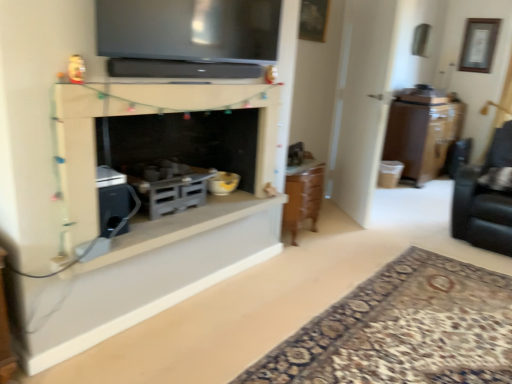
Question: Would you say wooden framed artwork at upper right, arranged as the first picture frame when viewed from the back, is inside or outside wooden picture frame at upper center, the 1th picture frame from the front?

Choices:
 (A) outside
 (B) inside

Answer: (A)

Question: From the image's perspective, relative to wooden picture frame at upper center, the 1th picture frame in the bottom-to-top sequence, is wooden framed artwork at upper right, the second picture frame when ordered from bottom to top, above or below?

Choices:
 (A) below
 (B) above

Answer: (B)

Question: Estimate the real-world distances between objects in this image. Which object is farther from the brown wood cabinet at right?

Choices:
 (A) wooden picture frame at upper center, the 2th picture frame when ordered from top to bottom
 (B) matte gray stove at center, the third appliance when ordered from top to bottom
 (C) white glossy bowl at center, the 2th appliance when ordered from bottom to top
 (D) white matte fireplace at center, the 1th window sill in the top-to-bottom sequence
 (E) wooden framed artwork at upper right, the second picture frame viewed from the left

Answer: (B)

Question: Based on their relative distances, which object is nearer to the white matte fireplace at center?

Choices:
 (A) wooden picture frame at upper center, which is the first picture frame in left-to-right order
 (B) wooden framed artwork at upper right, the second picture frame viewed from the left
 (C) white glossy bowl at center, the 2th appliance when ordered from bottom to top
 (D) matte gray stove at center, the third appliance when ordered from top to bottom
 (E) carpet with intricate pattern at lower right

Answer: (D)